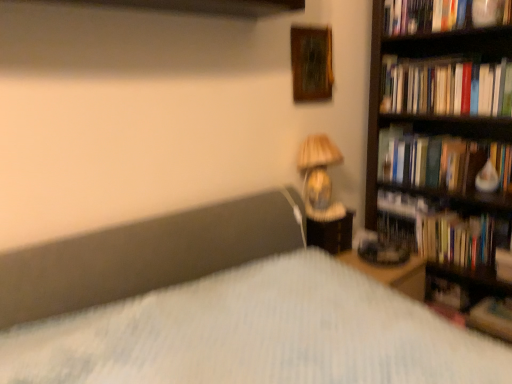
Question: From a real-world perspective, is hardcover book at upper right, which is the fourth book from bottom to top, under hardcover books at right, the second book viewed from the top?

Choices:
 (A) yes
 (B) no

Answer: (B)

Question: Is hardcover book at upper right, the first book from the top, far away from hardcover books at right, the second book viewed from the top?

Choices:
 (A) no
 (B) yes

Answer: (A)

Question: Is hardcover book at upper right, which is the fourth book from bottom to top, in front of hardcover books at right, the second book viewed from the top?

Choices:
 (A) no
 (B) yes

Answer: (A)

Question: Can you confirm if hardcover book at upper right, which is the fourth book from bottom to top, is positioned to the right of hardcover books at right, the second book viewed from the top?

Choices:
 (A) yes
 (B) no

Answer: (B)

Question: Considering the relative sizes of hardcover book at upper right, the first book from the top, and hardcover books at right, the second book viewed from the top, in the image provided, is hardcover book at upper right, the first book from the top, bigger than hardcover books at right, the second book viewed from the top,?

Choices:
 (A) yes
 (B) no

Answer: (A)

Question: In terms of width, does hardcover book at upper right, the first book from the top, look wider or thinner when compared to matte beige lampshade at upper right?

Choices:
 (A) wide
 (B) thin

Answer: (A)

Question: In terms of height, does hardcover book at upper right, which is the fourth book from bottom to top, look taller or shorter compared to matte beige lampshade at upper right?

Choices:
 (A) tall
 (B) short

Answer: (B)

Question: Is hardcover book at upper right, which is the fourth book from bottom to top, inside or outside of matte beige lampshade at upper right?

Choices:
 (A) inside
 (B) outside

Answer: (B)

Question: From the image's perspective, relative to matte beige lampshade at upper right, is hardcover book at upper right, the first book from the top, above or below?

Choices:
 (A) above
 (B) below

Answer: (A)

Question: From the image's perspective, is hardcover books at right, which is counted as the 3th book, starting from the bottom, above or below hardcover book at right?

Choices:
 (A) above
 (B) below

Answer: (A)

Question: In terms of height, does hardcover books at right, which is counted as the 3th book, starting from the bottom, look taller or shorter compared to hardcover book at right?

Choices:
 (A) short
 (B) tall

Answer: (B)

Question: Do you think hardcover books at right, which is counted as the 3th book, starting from the bottom, is within hardcover book at right, or outside of it?

Choices:
 (A) inside
 (B) outside

Answer: (B)

Question: Considering the positions of hardcover books at right, which is counted as the 3th book, starting from the bottom, and hardcover book at right in the image, is hardcover books at right, which is counted as the 3th book, starting from the bottom, bigger or smaller than hardcover book at right?

Choices:
 (A) big
 (B) small

Answer: (A)

Question: From the image's perspective, is wooden picture frame at upper center above or below hardcover books at right, which is counted as the 3th book, starting from the bottom?

Choices:
 (A) above
 (B) below

Answer: (A)

Question: Is wooden picture frame at upper center wider or thinner than hardcover books at right, which is counted as the 3th book, starting from the bottom?

Choices:
 (A) thin
 (B) wide

Answer: (A)